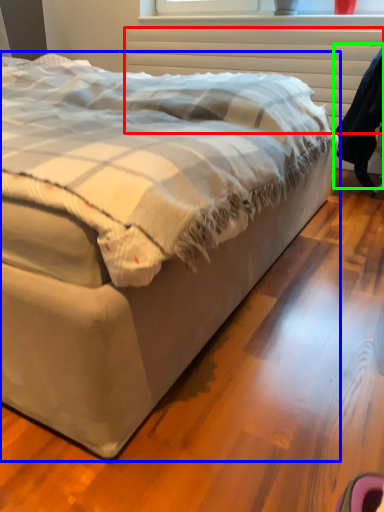
Question: Estimate the real-world distances between objects in this image. Which object is farther from radiator (highlighted by a red box), bed (highlighted by a blue box) or robe (highlighted by a green box)?

Choices:
 (A) bed
 (B) robe

Answer: (A)